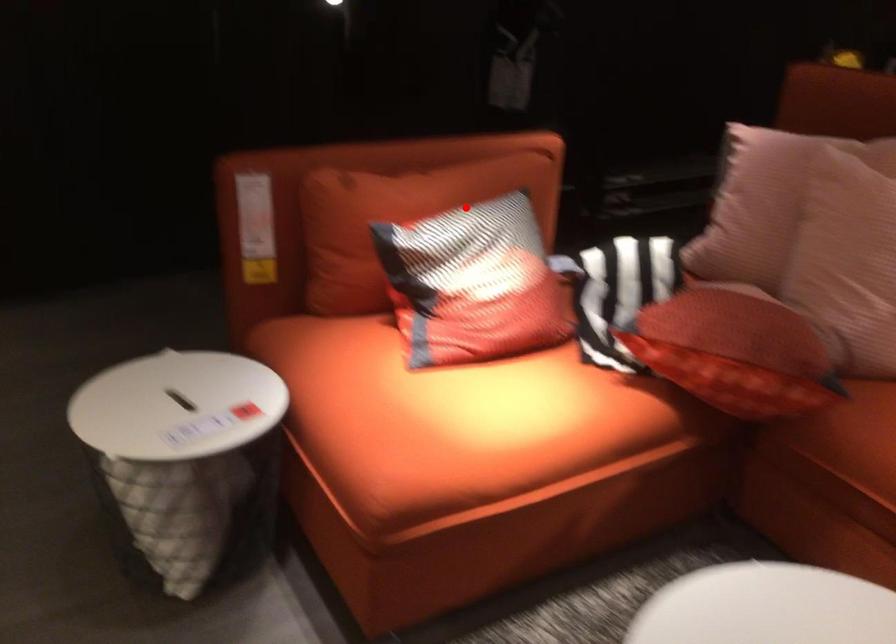
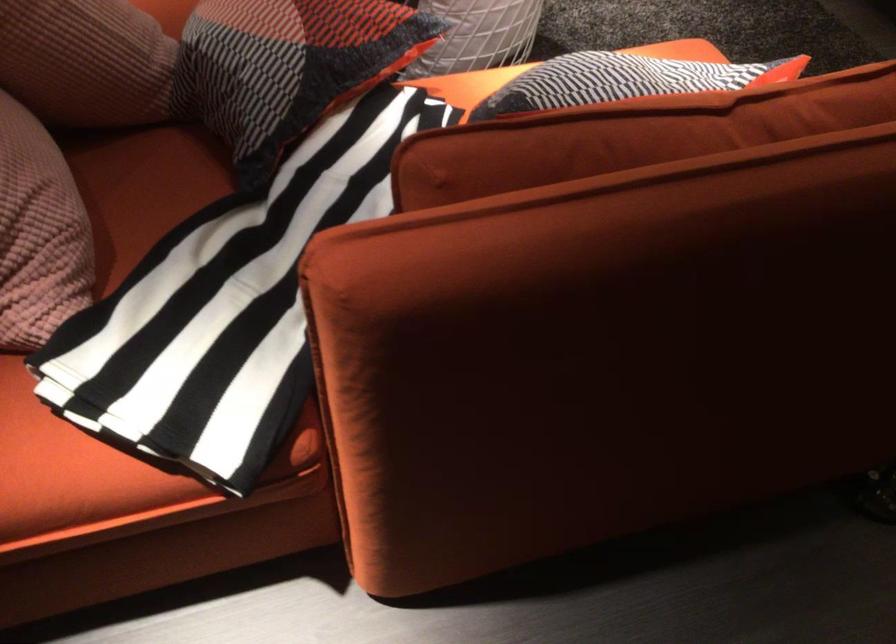
Question: I am providing you with two images of the same scene from different viewpoints. In image1, a red point is highlighted. Considering the same 3D point in image2, which of the following is correct?

Choices:
 (A) It is closer
 (B) It is farther

Answer: (A)